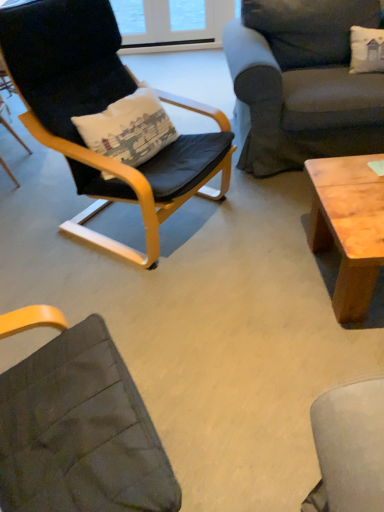
The height and width of the screenshot is (512, 384). What are the coordinates of `dark gray fabric couch at upper right` in the screenshot? It's located at (302, 83).

This screenshot has width=384, height=512. Identify the location of matte black chair at left, which ranks as the first chair in left-to-right order. (11, 127).

The height and width of the screenshot is (512, 384). What are the coordinates of `dark gray fabric couch at upper right` in the screenshot? It's located at (302, 83).

Is point (126, 95) closer or farther from the camera than point (285, 152)?

Point (126, 95) is positioned closer to the camera compared to point (285, 152).

Is black leather chair at left, the first chair when ordered from right to left, facing towards dark gray fabric couch at upper right?

No, black leather chair at left, the first chair when ordered from right to left, is not oriented towards dark gray fabric couch at upper right.

Is black leather chair at left, the first chair when ordered from right to left, far away from dark gray fabric couch at upper right?

They are positioned close to each other.

From a real-world perspective, is black leather chair at left, which is the second chair from left to right, positioned over dark gray fabric couch at upper right based on gravity?

Yes, from a real-world perspective, black leather chair at left, which is the second chair from left to right, is above dark gray fabric couch at upper right.

Can dark gray fabric couch at upper right be found inside natural wood coffee table at right?

No.

From a real-world perspective, is natural wood coffee table at right located beneath dark gray fabric couch at upper right?

Indeed, from a real-world perspective, natural wood coffee table at right is positioned beneath dark gray fabric couch at upper right.

Is natural wood coffee table at right positioned far away from dark gray fabric couch at upper right?

natural wood coffee table at right is near dark gray fabric couch at upper right, not far away.

The height and width of the screenshot is (512, 384). There is a natural wood coffee table at right. Find the location of `studio couch above it (from a real-world perspective)`. studio couch above it (from a real-world perspective) is located at coordinates (302, 83).

Which of these two, natural wood coffee table at right or matte black chair at left, which ranks as the first chair in left-to-right order, is thinner?

Thinner between the two is matte black chair at left, which ranks as the first chair in left-to-right order.

Does natural wood coffee table at right have a lesser height compared to matte black chair at left, placed as the second chair when sorted from right to left?

Yes, natural wood coffee table at right is shorter than matte black chair at left, placed as the second chair when sorted from right to left.

Is natural wood coffee table at right facing away from matte black chair at left, which ranks as the first chair in left-to-right order?

No, natural wood coffee table at right's orientation is not away from matte black chair at left, which ranks as the first chair in left-to-right order.

This screenshot has height=512, width=384. Identify the location of coffee table on the right of matte black chair at left, placed as the second chair when sorted from right to left. (348, 227).

From the image's perspective, would you say dark gray fabric couch at upper right is positioned over matte black chair at left, which ranks as the first chair in left-to-right order?

Yes.

Choose the correct answer: Is dark gray fabric couch at upper right inside matte black chair at left, placed as the second chair when sorted from right to left, or outside it?

dark gray fabric couch at upper right is outside matte black chair at left, placed as the second chair when sorted from right to left.

Can you tell me how much dark gray fabric couch at upper right and matte black chair at left, which ranks as the first chair in left-to-right order, differ in facing direction?

88.5 degrees separate the facing orientations of dark gray fabric couch at upper right and matte black chair at left, which ranks as the first chair in left-to-right order.

Can you tell me how much matte black chair at left, which ranks as the first chair in left-to-right order, and dark gray fabric couch at upper right differ in facing direction?

The angle between the facing direction of matte black chair at left, which ranks as the first chair in left-to-right order, and the facing direction of dark gray fabric couch at upper right is 88.5 degrees.

From the image's perspective, is matte black chair at left, which ranks as the first chair in left-to-right order, located above dark gray fabric couch at upper right?

No.

Could you measure the distance between matte black chair at left, which ranks as the first chair in left-to-right order, and dark gray fabric couch at upper right?

The distance of matte black chair at left, which ranks as the first chair in left-to-right order, from dark gray fabric couch at upper right is 5.40 feet.

I want to click on studio couch above the matte black chair at left, which ranks as the first chair in left-to-right order (from a real-world perspective), so coord(302,83).

From the image's perspective, relative to natural wood coffee table at right, is dark gray fabric couch at upper right above or below?

From the image's perspective, dark gray fabric couch at upper right appears above natural wood coffee table at right.

Based on the photo, is dark gray fabric couch at upper right not close to natural wood coffee table at right?

Actually, dark gray fabric couch at upper right and natural wood coffee table at right are a little close together.

From a real-world perspective, who is located higher, dark gray fabric couch at upper right or natural wood coffee table at right?

In real-world perspective, dark gray fabric couch at upper right is above.

Where is `studio couch above the natural wood coffee table at right (from a real-world perspective)`? This screenshot has width=384, height=512. studio couch above the natural wood coffee table at right (from a real-world perspective) is located at coordinates (302, 83).

Is dark gray fabric couch at upper right bigger than black leather chair at left, the first chair when ordered from right to left?

Indeed, dark gray fabric couch at upper right has a larger size compared to black leather chair at left, the first chair when ordered from right to left.

In terms of width, does dark gray fabric couch at upper right look wider or thinner when compared to black leather chair at left, the first chair when ordered from right to left?

dark gray fabric couch at upper right is wider than black leather chair at left, the first chair when ordered from right to left.

Based on the photo, from the image's perspective, is dark gray fabric couch at upper right on top of black leather chair at left, the first chair when ordered from right to left?

Yes, from the image's perspective, dark gray fabric couch at upper right is above black leather chair at left, the first chair when ordered from right to left.

This screenshot has height=512, width=384. I want to click on studio couch directly beneath the black leather chair at left, which is the second chair from left to right (from a real-world perspective), so click(302, 83).

At what (x,y) coordinates should I click in order to perform the action: click on coffee table below the dark gray fabric couch at upper right (from the image's perspective). Please return your answer as a coordinate pair (x, y). The image size is (384, 512). Looking at the image, I should click on (348, 227).

Considering their positions, is dark gray fabric couch at upper right positioned closer to natural wood coffee table at right than matte black chair at left, placed as the second chair when sorted from right to left?

dark gray fabric couch at upper right is positioned closer to the anchor natural wood coffee table at right.

Which object lies nearer to the anchor point black leather chair at left, the first chair when ordered from right to left, dark gray fabric couch at upper right or matte black chair at left, placed as the second chair when sorted from right to left?

dark gray fabric couch at upper right lies closer to black leather chair at left, the first chair when ordered from right to left, than the other object.

From the image, which object appears to be farther from natural wood coffee table at right, matte black chair at left, placed as the second chair when sorted from right to left, or dark gray fabric couch at upper right?

matte black chair at left, placed as the second chair when sorted from right to left, is positioned further to the anchor natural wood coffee table at right.

Considering their positions, is dark gray fabric couch at upper right positioned closer to matte black chair at left, placed as the second chair when sorted from right to left, than black leather chair at left, the first chair when ordered from right to left?

black leather chair at left, the first chair when ordered from right to left, is positioned closer to the anchor matte black chair at left, placed as the second chair when sorted from right to left.

Looking at the image, which one is located closer to dark gray fabric couch at upper right, matte black chair at left, which ranks as the first chair in left-to-right order, or natural wood coffee table at right?

Among the two, natural wood coffee table at right is located nearer to dark gray fabric couch at upper right.

Which object lies nearer to the anchor point matte black chair at left, which ranks as the first chair in left-to-right order, dark gray fabric couch at upper right or natural wood coffee table at right?

dark gray fabric couch at upper right is closer to matte black chair at left, which ranks as the first chair in left-to-right order.

Which object lies further to the anchor point matte black chair at left, placed as the second chair when sorted from right to left, natural wood coffee table at right or black leather chair at left, which is the second chair from left to right?

natural wood coffee table at right is further to matte black chair at left, placed as the second chair when sorted from right to left.

When comparing their distances from natural wood coffee table at right, does matte black chair at left, placed as the second chair when sorted from right to left, or black leather chair at left, which is the second chair from left to right, seem closer?

Based on the image, black leather chair at left, which is the second chair from left to right, appears to be nearer to natural wood coffee table at right.

Find the location of a particular element. chair between matte black chair at left, which ranks as the first chair in left-to-right order, and natural wood coffee table at right from left to right is located at coordinates (99, 111).

Identify the location of coffee table located between black leather chair at left, which is the second chair from left to right, and dark gray fabric couch at upper right in the left-right direction. Image resolution: width=384 pixels, height=512 pixels. (348, 227).

The height and width of the screenshot is (512, 384). In order to click on coffee table between matte black chair at left, which ranks as the first chair in left-to-right order, and dark gray fabric couch at upper right from left to right in this screenshot , I will do `click(348, 227)`.

You are a GUI agent. You are given a task and a screenshot of the screen. Output one action in this format:
    pyautogui.click(x=<x>, y=<y>)
    Task: Click on the chair between matte black chair at left, which ranks as the first chair in left-to-right order, and dark gray fabric couch at upper right, in the horizontal direction
    
    Given the screenshot: What is the action you would take?
    pyautogui.click(x=99, y=111)